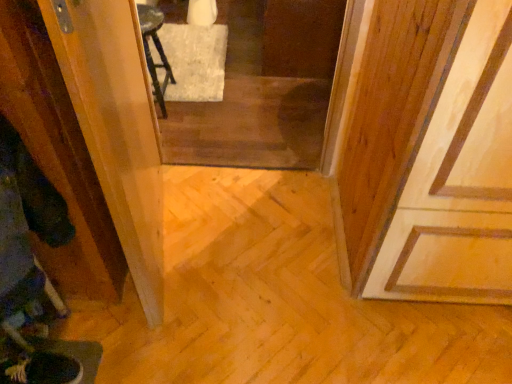
Question: From the image's perspective, is transparent glass screen door at center, the 1th screen door viewed from the right, located above transparent plastic screen door at left, arranged as the 1th screen door when viewed from the left?

Choices:
 (A) yes
 (B) no

Answer: (A)

Question: Is transparent glass screen door at center, the 2th screen door positioned from the front, further to camera compared to transparent plastic screen door at left, which ranks as the 1th screen door in front-to-back order?

Choices:
 (A) no
 (B) yes

Answer: (B)

Question: Is transparent glass screen door at center, which is the first screen door from back to front, oriented towards transparent plastic screen door at left, arranged as the 1th screen door when viewed from the left?

Choices:
 (A) no
 (B) yes

Answer: (A)

Question: From a real-world perspective, does transparent glass screen door at center, the 1th screen door viewed from the right, stand above transparent plastic screen door at left, placed as the 2th screen door when sorted from right to left?

Choices:
 (A) no
 (B) yes

Answer: (A)

Question: Considering the relative sizes of transparent glass screen door at center, the 2th screen door positioned from the front, and transparent plastic screen door at left, the second screen door in the back-to-front sequence, in the image provided, is transparent glass screen door at center, the 2th screen door positioned from the front, shorter than transparent plastic screen door at left, the second screen door in the back-to-front sequence,?

Choices:
 (A) no
 (B) yes

Answer: (B)

Question: Does transparent glass screen door at center, arranged as the second screen door when viewed from the left, have a lesser width compared to transparent plastic screen door at left, arranged as the 1th screen door when viewed from the left?

Choices:
 (A) yes
 (B) no

Answer: (B)

Question: Is transparent plastic screen door at left, the second screen door in the back-to-front sequence, beside transparent glass screen door at center, the 2th screen door positioned from the front?

Choices:
 (A) yes
 (B) no

Answer: (B)

Question: From the image's perspective, is transparent plastic screen door at left, arranged as the 1th screen door when viewed from the left, above transparent glass screen door at center, arranged as the second screen door when viewed from the left?

Choices:
 (A) yes
 (B) no

Answer: (B)

Question: From a real-world perspective, is transparent plastic screen door at left, the second screen door in the back-to-front sequence, under transparent glass screen door at center, the 1th screen door viewed from the right?

Choices:
 (A) yes
 (B) no

Answer: (B)

Question: From the image's perspective, is transparent plastic screen door at left, which ranks as the 1th screen door in front-to-back order, below transparent glass screen door at center, which is the first screen door from back to front?

Choices:
 (A) yes
 (B) no

Answer: (A)

Question: Would you say transparent plastic screen door at left, placed as the 2th screen door when sorted from right to left, is outside transparent glass screen door at center, the 1th screen door viewed from the right?

Choices:
 (A) yes
 (B) no

Answer: (A)

Question: Would you say transparent glass screen door at center, which is the first screen door from back to front, is part of transparent plastic screen door at left, the second screen door in the back-to-front sequence,'s contents?

Choices:
 (A) yes
 (B) no

Answer: (B)

Question: Do you think transparent plastic screen door at left, which ranks as the 1th screen door in front-to-back order, is within transparent glass screen door at center, the 2th screen door positioned from the front, or outside of it?

Choices:
 (A) outside
 (B) inside

Answer: (A)